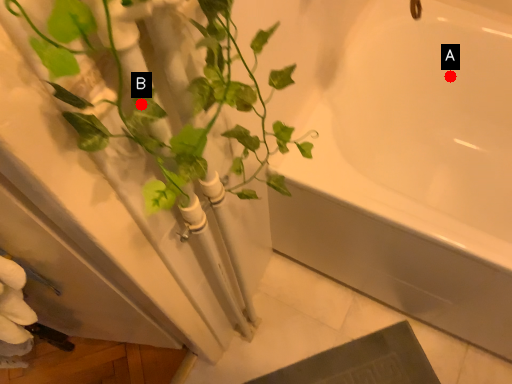
Question: Two points are circled on the image, labeled by A and B beside each circle. Which point is closer to the camera?

Choices:
 (A) A is closer
 (B) B is closer

Answer: (B)